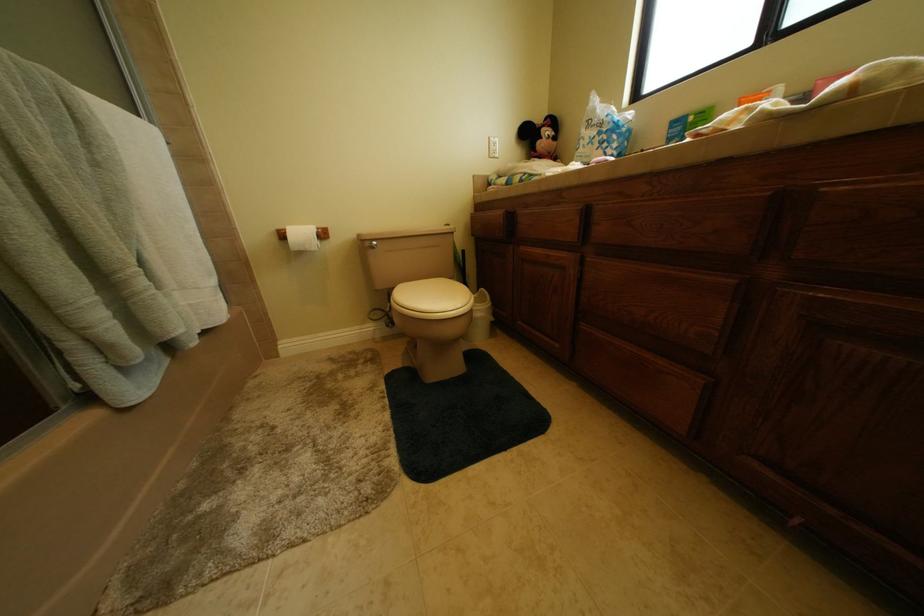
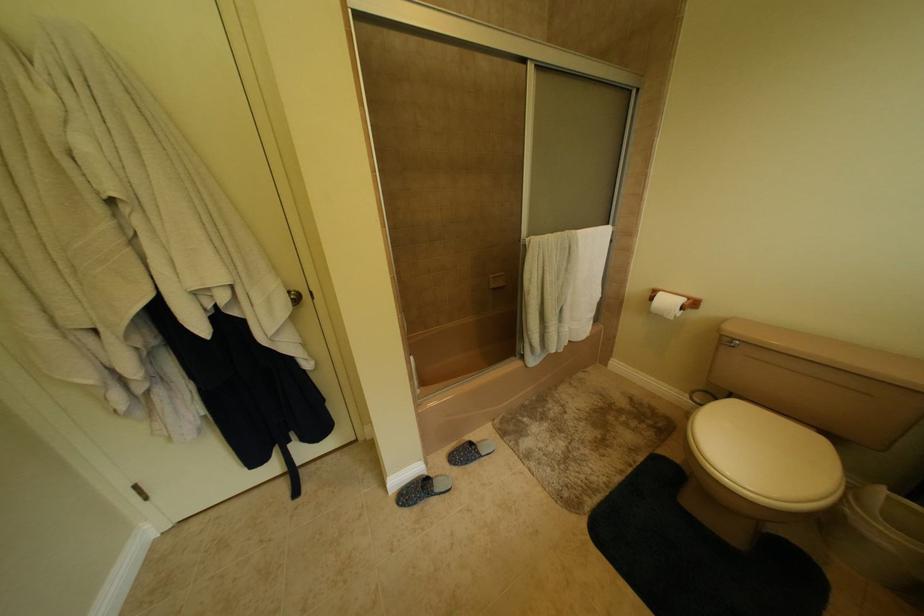
Based on the continuous images, in which direction is the camera rotating?

The camera rotated toward left-down.